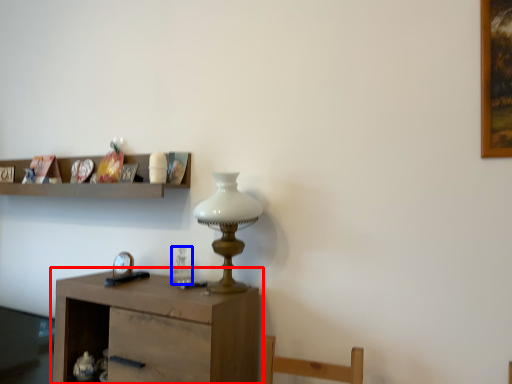
Question: Among these objects, which one is farthest to the camera, table (highlighted by a red box) or glass vase (highlighted by a blue box)?

Choices:
 (A) table
 (B) glass vase

Answer: (B)